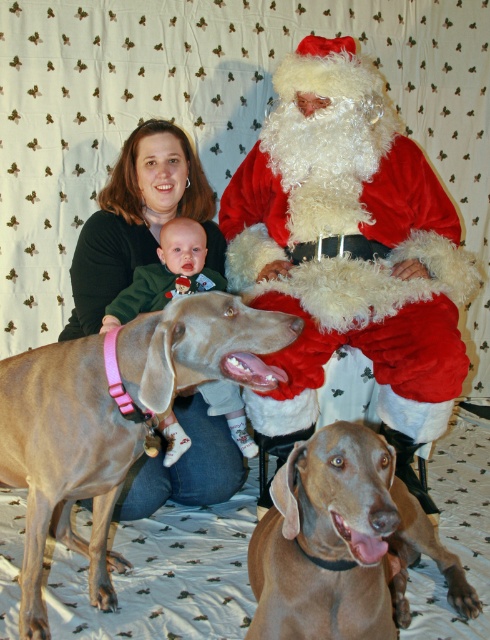
Does velvet santa claus at center appear on the right side of soft pink fabric baby at center?

Correct, you'll find velvet santa claus at center to the right of soft pink fabric baby at center.

Can you confirm if velvet santa claus at center is positioned above soft pink fabric baby at center?

Correct, velvet santa claus at center is located above soft pink fabric baby at center.

Between point (415, 442) and point (165, 269), which one is positioned behind?

Positioned behind is point (415, 442).

Find the location of `velvet santa claus at center`. velvet santa claus at center is located at coordinates (348, 250).

Describe the element at coordinates (348, 250) in the screenshot. I see `velvet santa claus at center` at that location.

Is velvet santa claus at center shorter than brown smooth coat at lower center?

Incorrect, velvet santa claus at center's height does not fall short of brown smooth coat at lower center's.

Is point (319, 330) farther from camera compared to point (372, 513)?

Yes, it is behind point (372, 513).

At what (x,y) coordinates should I click in order to perform the action: click on velvet santa claus at center. Please return your answer as a coordinate pair (x, y). Looking at the image, I should click on (348, 250).

From the picture: Between velvet santa claus at center and smooth tan dog at center, which one is positioned lower?

Positioned lower is smooth tan dog at center.

Is point (260, 188) closer to viewer compared to point (79, 355)?

No, (260, 188) is behind (79, 355).

Image resolution: width=490 pixels, height=640 pixels. I want to click on velvet santa claus at center, so click(348, 250).